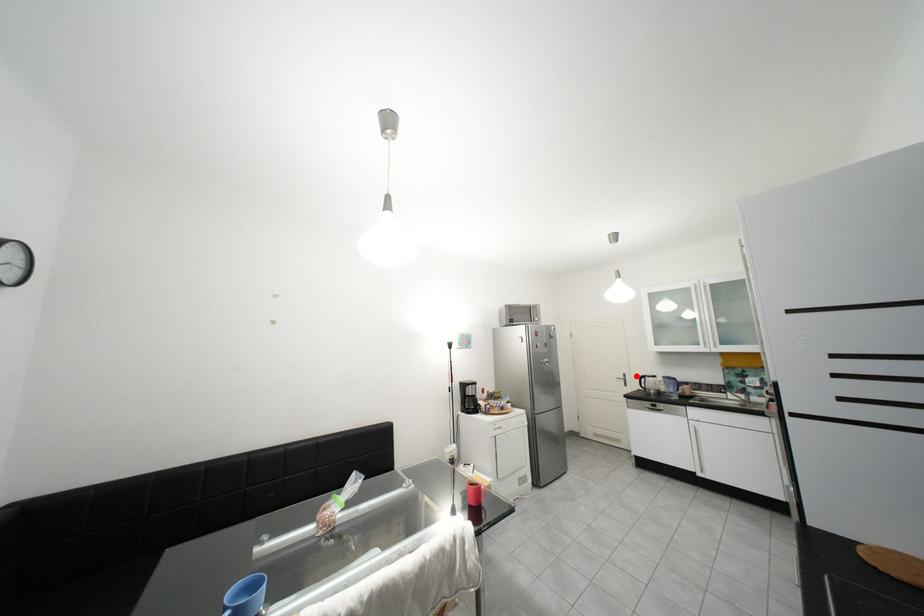
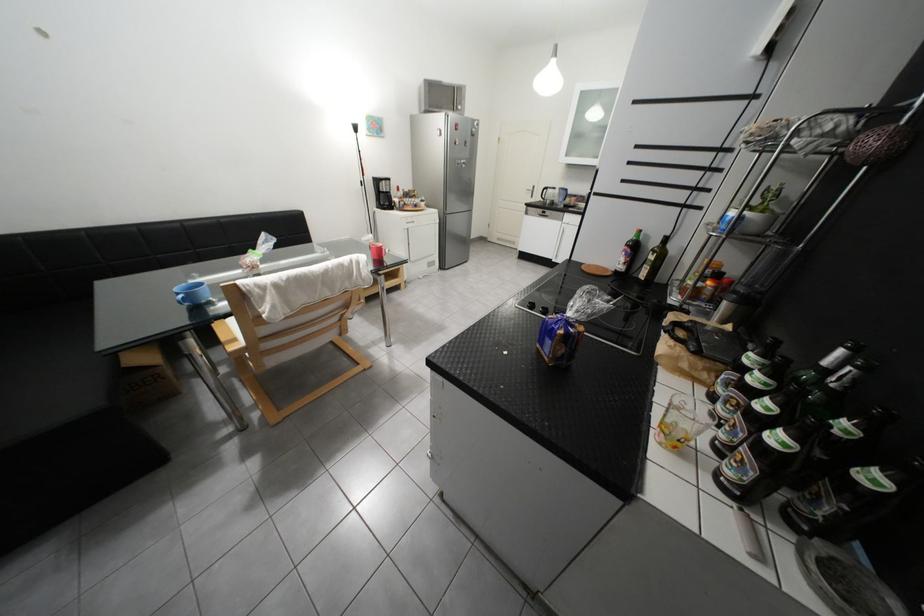
Question: I am providing you with two images of the same scene from different viewpoints. A red point is shown in image1. For the corresponding object point in image2, is it positioned nearer or farther from the camera?

Choices:
 (A) Nearer
 (B) Farther

Answer: (A)